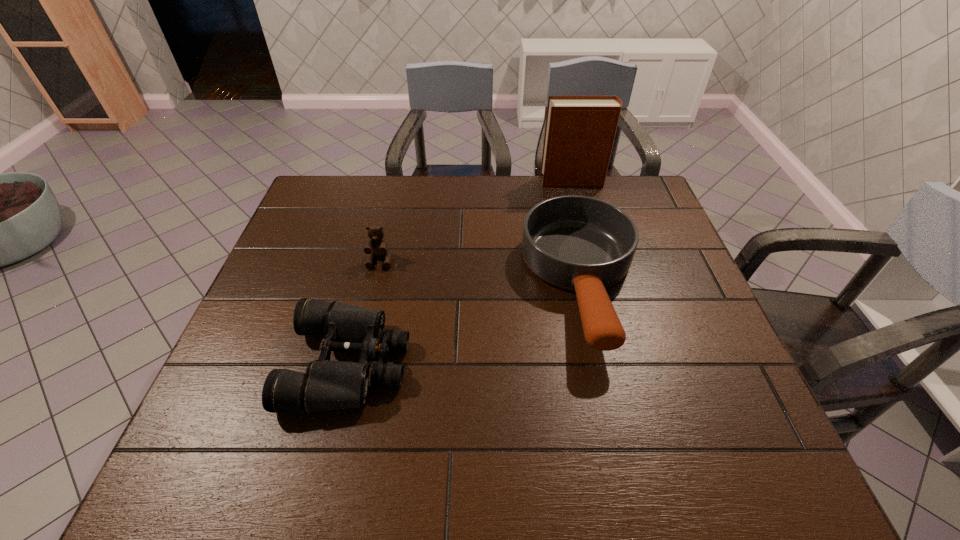
Where is `vacant space located 0.320m through the eyepieces of the shortest object`? The width and height of the screenshot is (960, 540). vacant space located 0.320m through the eyepieces of the shortest object is located at coordinates (550, 363).

Find the location of a particular element. Image resolution: width=960 pixels, height=540 pixels. object that is at the far edge is located at coordinates (580, 130).

At what (x,y) coordinates should I click in order to perform the action: click on object that is at the left edge. Please return your answer as a coordinate pair (x, y). The width and height of the screenshot is (960, 540). Looking at the image, I should click on (327, 385).

Image resolution: width=960 pixels, height=540 pixels. What are the coordinates of `hardback book located at the right edge` in the screenshot? It's located at pos(580,130).

In order to click on pan that is at the right edge in this screenshot , I will do `click(579, 243)`.

Locate an element on the screen. object at the far right corner is located at coordinates (580, 130).

Identify the location of vacant region at the far edge. (548, 194).

In the image, there is a desktop. Identify the location of vacant space at the near edge. (664, 456).

At what (x,y) coordinates should I click in order to perform the action: click on vacant space at the left edge of the desktop. Please return your answer as a coordinate pair (x, y). Looking at the image, I should click on (274, 291).

At what (x,y) coordinates should I click in order to perform the action: click on vacant space at the right edge. Please return your answer as a coordinate pair (x, y). The image size is (960, 540). Looking at the image, I should click on (703, 426).